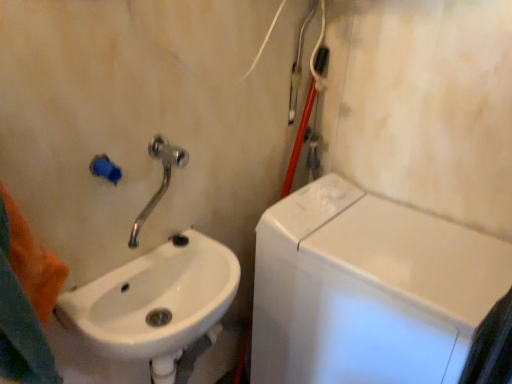
Question: From a real-world perspective, is white glossy washing machine at right positioned above or below white glossy sink at lower left?

Choices:
 (A) below
 (B) above

Answer: (A)

Question: Considering their positions, is white glossy washing machine at right located in front of or behind white glossy sink at lower left?

Choices:
 (A) front
 (B) behind

Answer: (B)

Question: Which object is positioned closest to the white glossy sink at lower left?

Choices:
 (A) silver metallic faucet at upper left
 (B) white glossy washing machine at right

Answer: (A)

Question: Estimate the real-world distances between objects in this image. Which object is closer to the white glossy washing machine at right?

Choices:
 (A) white glossy sink at lower left
 (B) silver metallic faucet at upper left

Answer: (A)